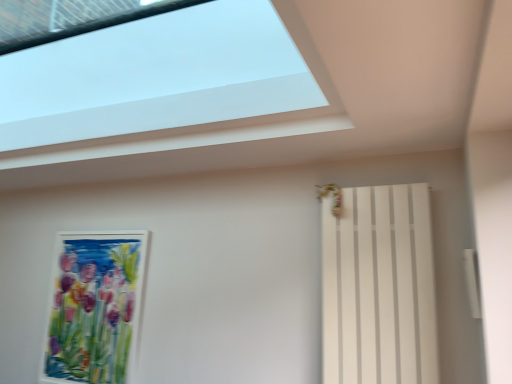
Question: Considering their positions, is watercolor paper painting at left located in front of or behind transparent glass window at upper center?

Choices:
 (A) front
 (B) behind

Answer: (B)

Question: Considering the positions of point (99, 347) and point (119, 41), is point (99, 347) closer or farther from the camera than point (119, 41)?

Choices:
 (A) closer
 (B) farther

Answer: (B)

Question: Estimate the real-world distances between objects in this image. Which object is farther from the transparent glass window at upper center?

Choices:
 (A) white matte radiator at right
 (B) watercolor paper painting at left

Answer: (A)

Question: Which of these objects is positioned closest to the watercolor paper painting at left?

Choices:
 (A) white matte radiator at right
 (B) transparent glass window at upper center

Answer: (B)